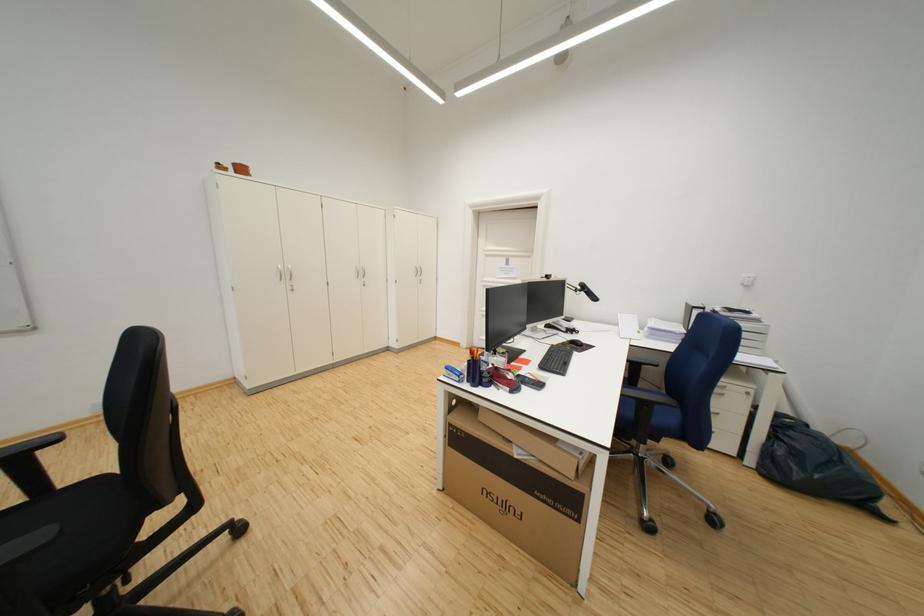
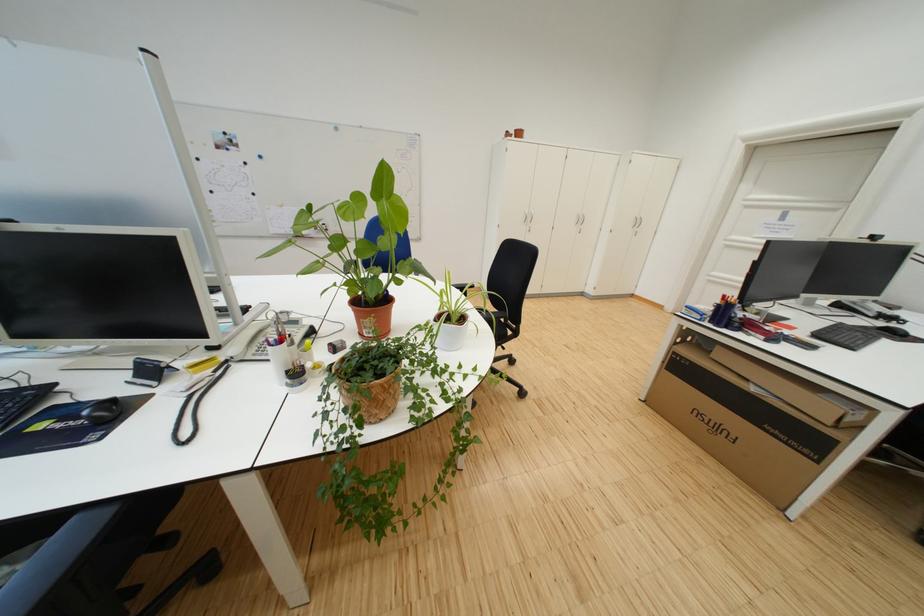
Question: The camera is either moving clockwise (left) or counter-clockwise (right) around the object. The first image is from the beginning of the video and the second image is from the end. Is the camera moving left or right when shooting the video?

Choices:
 (A) Left
 (B) Right

Answer: (B)